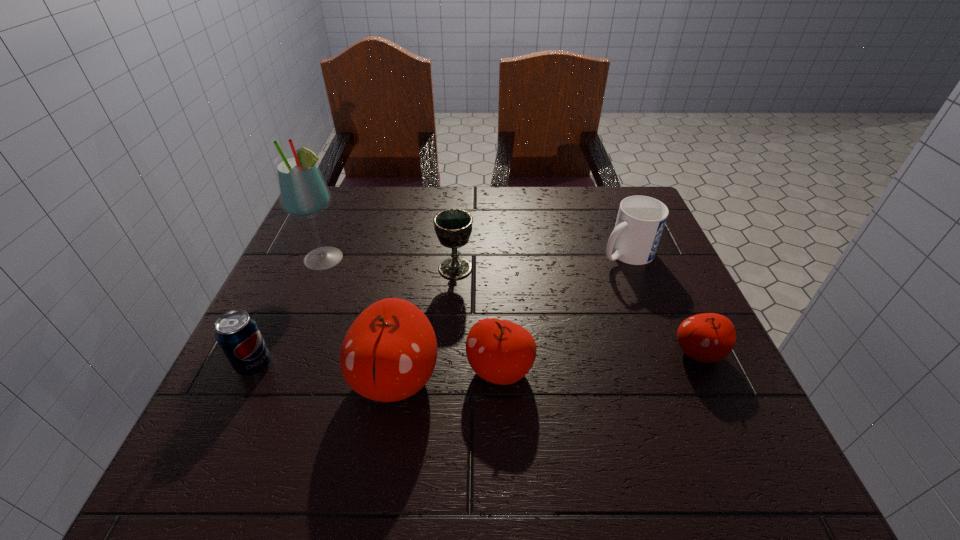
Please point a location where one more apple can be added evenly. Please provide its 2D coordinates. Your answer should be formatted as a tuple, i.e. [(x, y)], where the tuple contains the x and y coordinates of a point satisfying the conditions above.

[(601, 361)]